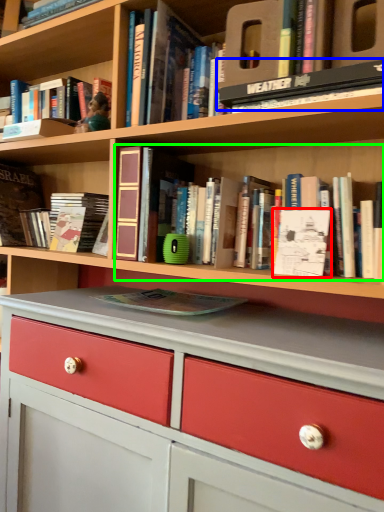
Question: Based on their relative distances, which object is nearer to paperback book (highlighted by a red box)? Choose from book (highlighted by a blue box) and book (highlighted by a green box).

Choices:
 (A) book
 (B) book

Answer: (B)